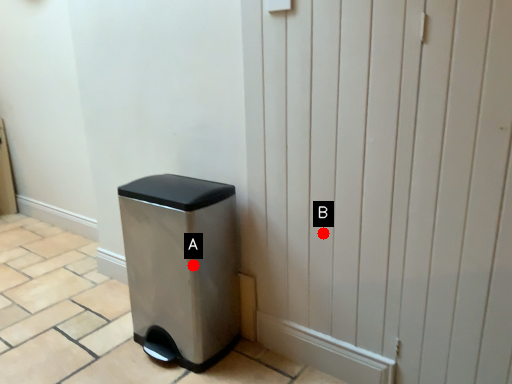
Question: Two points are circled on the image, labeled by A and B beside each circle. Which point is further to the camera?

Choices:
 (A) A is further
 (B) B is further

Answer: (A)